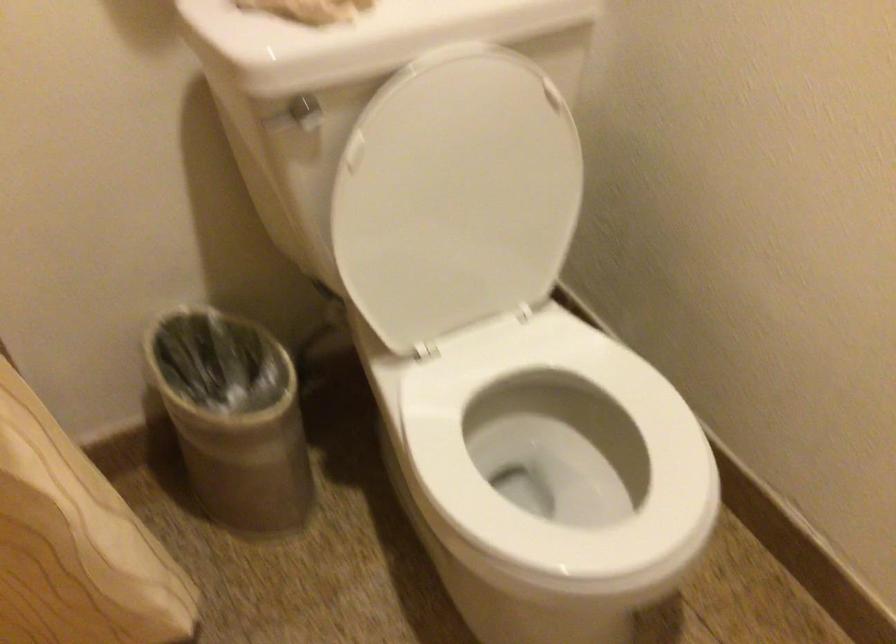
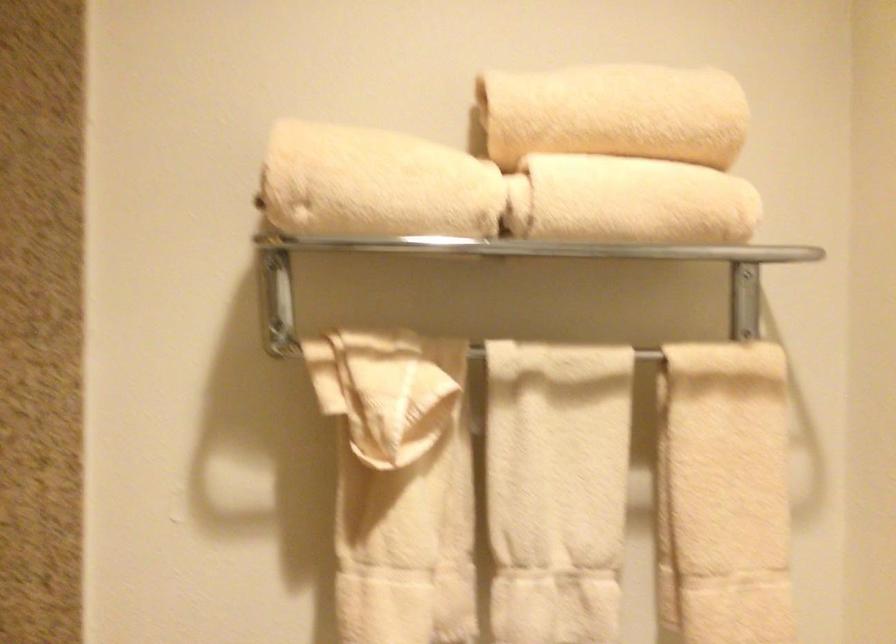
Looking at this image, based on the continuous images, in which direction is the camera rotating?

The camera's rotation is toward left-up.